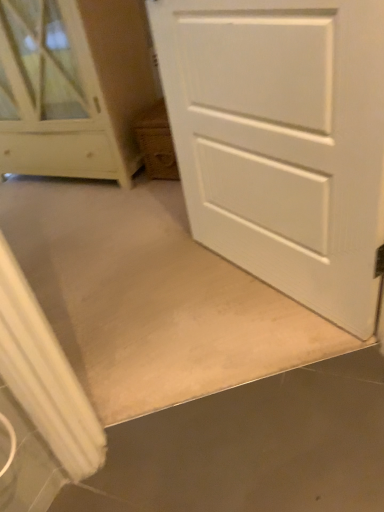
Where is `vacant space situated on the left part of white matte door at center`? The image size is (384, 512). vacant space situated on the left part of white matte door at center is located at coordinates (162, 304).